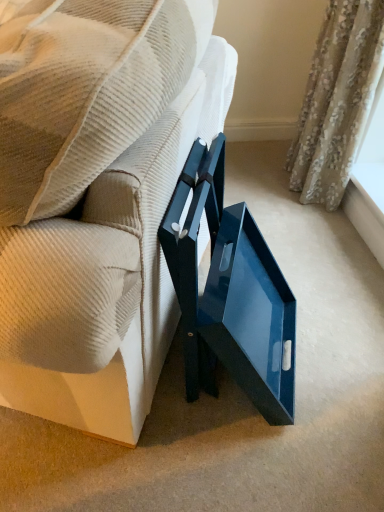
Question: Can you confirm if white textured window sill at upper right is thinner than floral fabric curtain at upper right?

Choices:
 (A) yes
 (B) no

Answer: (B)

Question: Is the position of white textured window sill at upper right less distant than that of floral fabric curtain at upper right?

Choices:
 (A) no
 (B) yes

Answer: (A)

Question: Is white textured window sill at upper right surrounding floral fabric curtain at upper right?

Choices:
 (A) yes
 (B) no

Answer: (B)

Question: Can you confirm if white textured window sill at upper right is taller than floral fabric curtain at upper right?

Choices:
 (A) no
 (B) yes

Answer: (A)

Question: Does white textured window sill at upper right have a lesser height compared to floral fabric curtain at upper right?

Choices:
 (A) no
 (B) yes

Answer: (B)

Question: Is white textured window sill at upper right to the left or to the right of floral fabric curtain at upper right in the image?

Choices:
 (A) right
 (B) left

Answer: (A)

Question: Is point (355, 218) positioned closer to the camera than point (342, 100)?

Choices:
 (A) closer
 (B) farther

Answer: (B)

Question: Relative to floral fabric curtain at upper right, is white textured window sill at upper right in front or behind?

Choices:
 (A) behind
 (B) front

Answer: (A)

Question: In terms of size, does white textured window sill at upper right appear bigger or smaller than floral fabric curtain at upper right?

Choices:
 (A) small
 (B) big

Answer: (A)

Question: Considering the positions of point (102, 223) and point (372, 249), is point (102, 223) closer or farther from the camera than point (372, 249)?

Choices:
 (A) closer
 (B) farther

Answer: (A)

Question: Is glossy blue tray at center in front of or behind white textured window sill at upper right in the image?

Choices:
 (A) behind
 (B) front

Answer: (B)

Question: In terms of width, does glossy blue tray at center look wider or thinner when compared to white textured window sill at upper right?

Choices:
 (A) thin
 (B) wide

Answer: (B)

Question: Visually, is glossy blue tray at center positioned to the left or to the right of white textured window sill at upper right?

Choices:
 (A) left
 (B) right

Answer: (A)

Question: Is point (329, 13) closer or farther from the camera than point (359, 183)?

Choices:
 (A) closer
 (B) farther

Answer: (A)

Question: From the image's perspective, is floral fabric curtain at upper right above or below white textured window sill at upper right?

Choices:
 (A) below
 (B) above

Answer: (B)